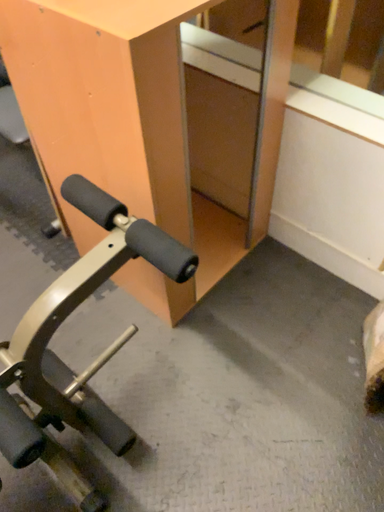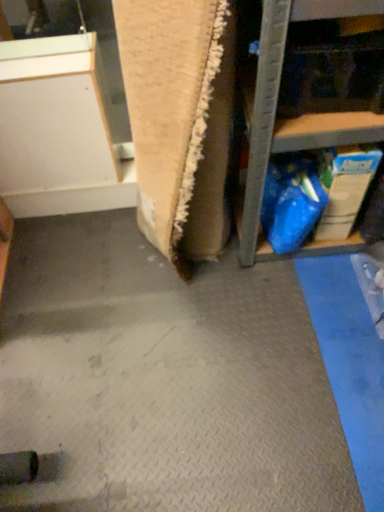
Question: Which way did the camera rotate in the video?

Choices:
 (A) rotated right
 (B) rotated left

Answer: (A)